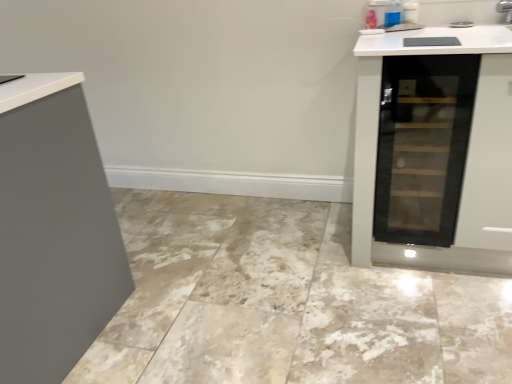
Locate an element on the screen. The width and height of the screenshot is (512, 384). blank space situated above marble tile at center (from a real-world perspective) is located at coordinates (254, 294).